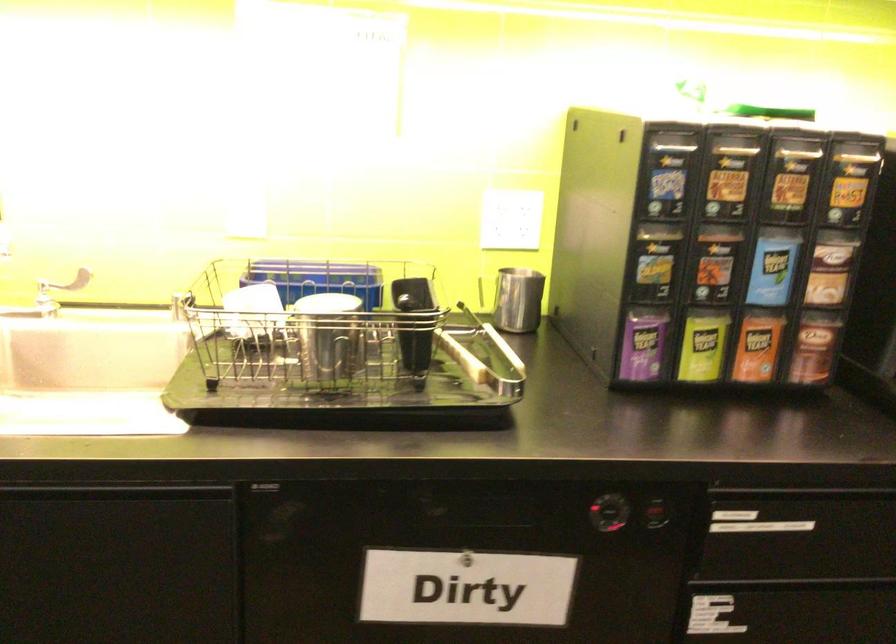
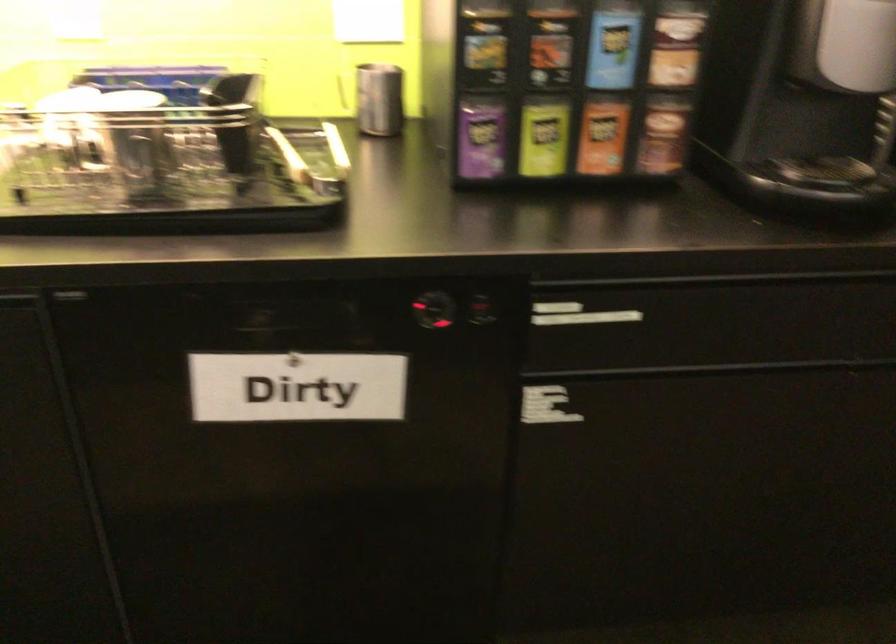
Find the pixel in the second image that matches (642,345) in the first image.

(479, 138)